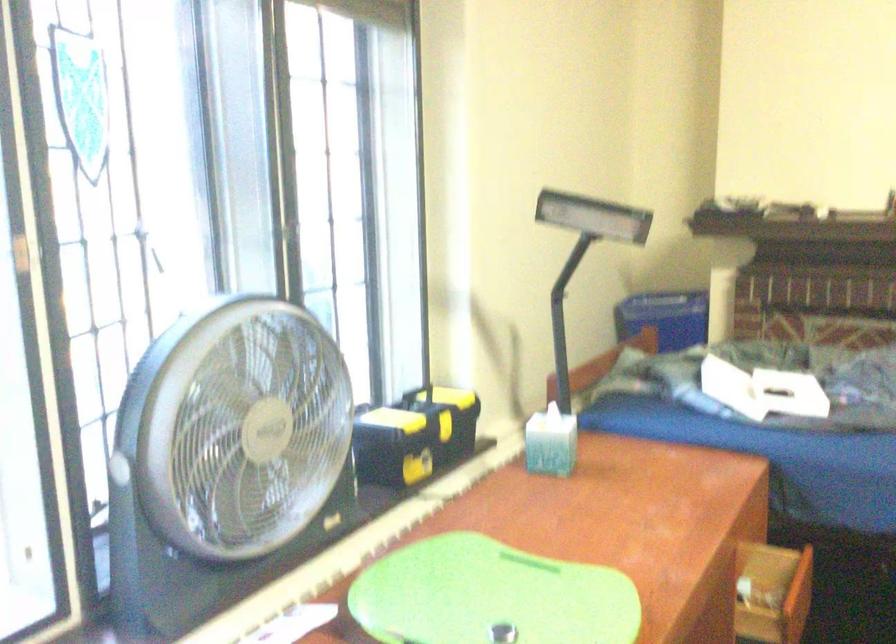
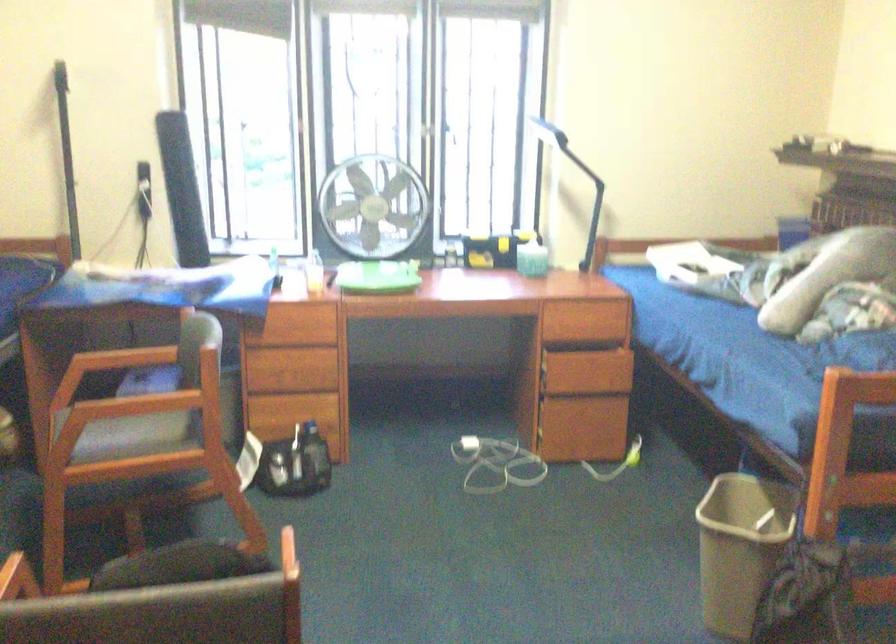
Find the pixel in the second image that matches the point at 490,308 in the first image.

(573, 178)